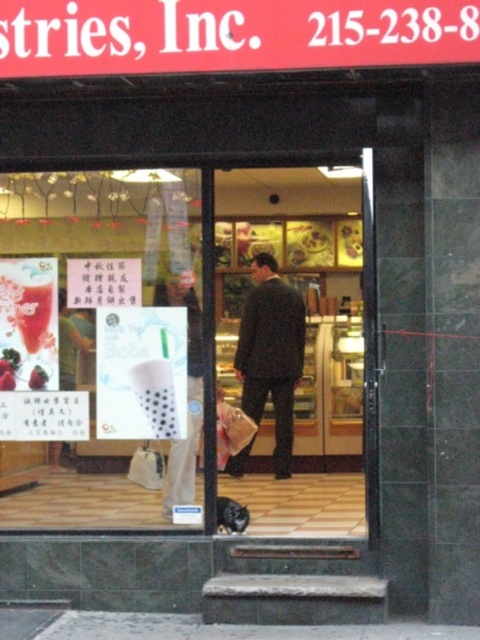
Does dark wool suit at center appear on the left side of white fabric shopping bag at lower center?

Incorrect, dark wool suit at center is not on the left side of white fabric shopping bag at lower center.

Identify the location of dark wool suit at center. This screenshot has height=640, width=480. (271, 353).

Measure the distance between dark wool suit at center and camera.

The distance of dark wool suit at center from camera is 24.67 feet.

I want to click on dark wool suit at center, so tap(271, 353).

Is transparent plastic sign at center taller than dark wool suit at center?

In fact, transparent plastic sign at center may be shorter than dark wool suit at center.

The width and height of the screenshot is (480, 640). What do you see at coordinates (110, 342) in the screenshot?
I see `transparent plastic sign at center` at bounding box center [110, 342].

This screenshot has height=640, width=480. What do you see at coordinates (110, 342) in the screenshot?
I see `transparent plastic sign at center` at bounding box center [110, 342].

The image size is (480, 640). I want to click on transparent plastic sign at center, so click(x=110, y=342).

Is transparent plastic sign at center in front of white fabric shopping bag at lower center?

Yes, it is in front of white fabric shopping bag at lower center.

This screenshot has width=480, height=640. Find the location of `transparent plastic sign at center`. transparent plastic sign at center is located at coordinates (110, 342).

Where is `transparent plastic sign at center`? transparent plastic sign at center is located at coordinates (110, 342).